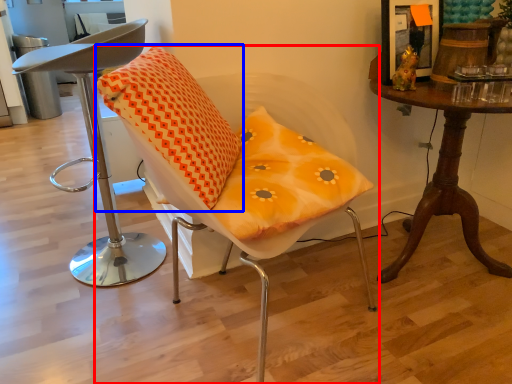
Question: Among these objects, which one is farthest to the camera, chair (highlighted by a red box) or pillow (highlighted by a blue box)?

Choices:
 (A) chair
 (B) pillow

Answer: (B)